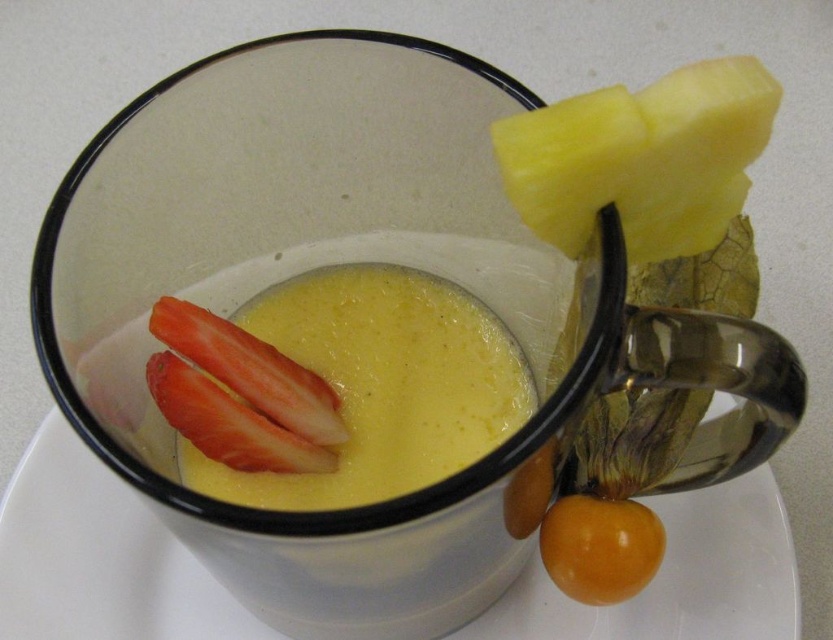
Which is behind, point (656, 259) or point (197, 420)?

Point (197, 420)

Image resolution: width=833 pixels, height=640 pixels. What do you see at coordinates (641, 157) in the screenshot?
I see `yellow smooth pineapple at upper right` at bounding box center [641, 157].

At what (x,y) coordinates should I click in order to perform the action: click on yellow smooth pineapple at upper right. Please return your answer as a coordinate pair (x, y). The image size is (833, 640). Looking at the image, I should click on (641, 157).

How distant is yellow smooth pineapple at upper right from orange glossy physalis at lower right?

The distance of yellow smooth pineapple at upper right from orange glossy physalis at lower right is 5.85 inches.

Who is shorter, yellow smooth pineapple at upper right or orange glossy physalis at lower right?

orange glossy physalis at lower right is shorter.

Who is more forward, (671, 234) or (631, 576)?

Point (671, 234) is more forward.

This screenshot has width=833, height=640. What are the coordinates of `yellow smooth pineapple at upper right` in the screenshot? It's located at (641, 157).

Does orange glossy physalis at lower right lie in front of red matte strawberry at lower left?

No.

Image resolution: width=833 pixels, height=640 pixels. What are the coordinates of `orange glossy physalis at lower right` in the screenshot? It's located at (600, 547).

Image resolution: width=833 pixels, height=640 pixels. Identify the location of orange glossy physalis at lower right. (600, 547).